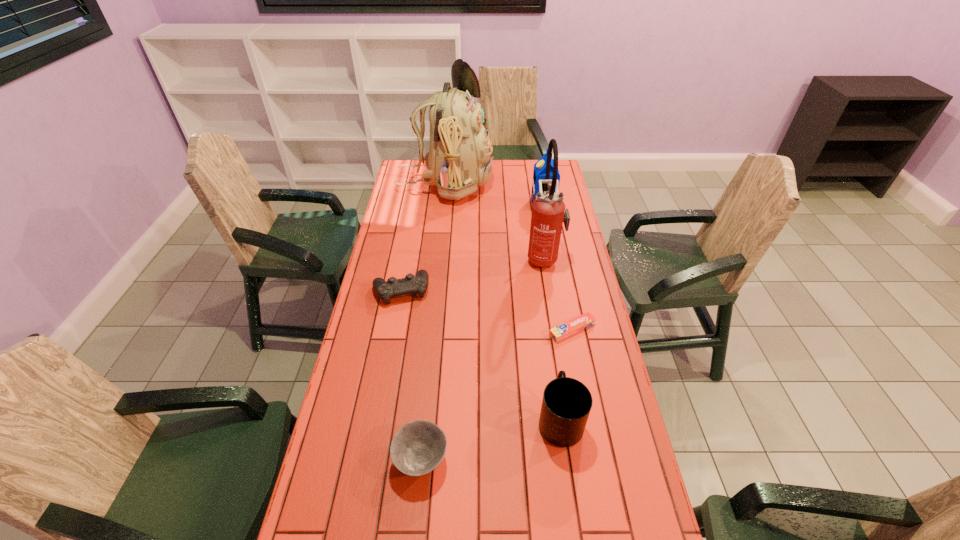
Locate an element on the screen. This screenshot has width=960, height=540. free space that satisfies the following two spatial constraints: 1. on the front side of the bowl; 2. on the left side of the control is located at coordinates (370, 460).